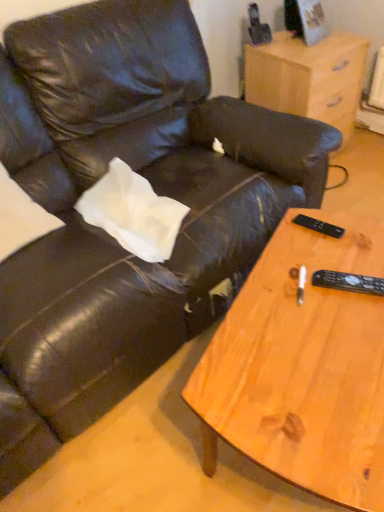
Question: From a real-world perspective, is wooden coffee table at lower right on black plastic remote at right, arranged as the 2th remote when viewed from the top?

Choices:
 (A) yes
 (B) no

Answer: (B)

Question: Does wooden coffee table at lower right have a lesser height compared to black plastic remote at right, the first remote from the bottom?

Choices:
 (A) yes
 (B) no

Answer: (B)

Question: Can you confirm if wooden coffee table at lower right is wider than black plastic remote at right, arranged as the 2th remote when viewed from the top?

Choices:
 (A) no
 (B) yes

Answer: (B)

Question: From a real-world perspective, does wooden coffee table at lower right sit lower than black plastic remote at right, the first remote from the bottom?

Choices:
 (A) yes
 (B) no

Answer: (A)

Question: From the image's perspective, is wooden coffee table at lower right below black plastic remote at right, the first remote from the front?

Choices:
 (A) yes
 (B) no

Answer: (A)

Question: From the image's perspective, relative to black plastic remote at right, the first remote from the front, is black plastic remote at right, the second remote from the front, above or below?

Choices:
 (A) below
 (B) above

Answer: (B)

Question: Relative to black plastic remote at right, arranged as the 2th remote when viewed from the top, is black plastic remote at right, the second remote positioned from the bottom, in front or behind?

Choices:
 (A) behind
 (B) front

Answer: (A)

Question: Which is correct: black plastic remote at right, the second remote from the front, is inside black plastic remote at right, acting as the 2th remote starting from the back, or outside of it?

Choices:
 (A) outside
 (B) inside

Answer: (A)

Question: Looking at their shapes, would you say black plastic remote at right, the first remote viewed from the back, is wider or thinner than black plastic remote at right, acting as the 2th remote starting from the back?

Choices:
 (A) thin
 (B) wide

Answer: (A)

Question: Considering their positions, is light wood/finely finished nightstand at upper right located in front of or behind black plastic remote at right, the first remote from the bottom?

Choices:
 (A) front
 (B) behind

Answer: (B)

Question: From a real-world perspective, relative to black plastic remote at right, the first remote from the bottom, is light wood/finely finished nightstand at upper right vertically above or below?

Choices:
 (A) below
 (B) above

Answer: (A)

Question: Is light wood/finely finished nightstand at upper right wider or thinner than black plastic remote at right, arranged as the 2th remote when viewed from the top?

Choices:
 (A) thin
 (B) wide

Answer: (B)

Question: Considering the positions of light wood/finely finished nightstand at upper right and black plastic remote at right, the first remote from the bottom, in the image, is light wood/finely finished nightstand at upper right bigger or smaller than black plastic remote at right, the first remote from the bottom,?

Choices:
 (A) small
 (B) big

Answer: (B)

Question: Visually, is light wood/finely finished nightstand at upper right positioned to the left or to the right of black plastic remote at right, which ranks as the 1th remote in top-to-bottom order?

Choices:
 (A) left
 (B) right

Answer: (B)

Question: In terms of height, does light wood/finely finished nightstand at upper right look taller or shorter compared to black plastic remote at right, the first remote viewed from the back?

Choices:
 (A) short
 (B) tall

Answer: (B)